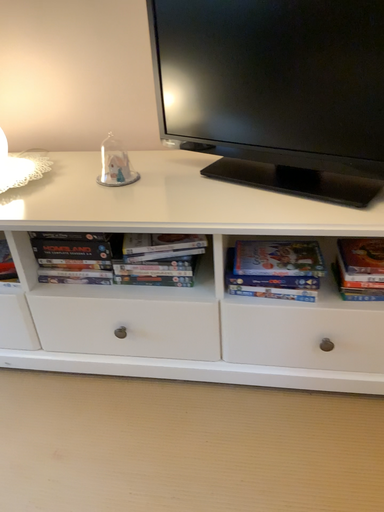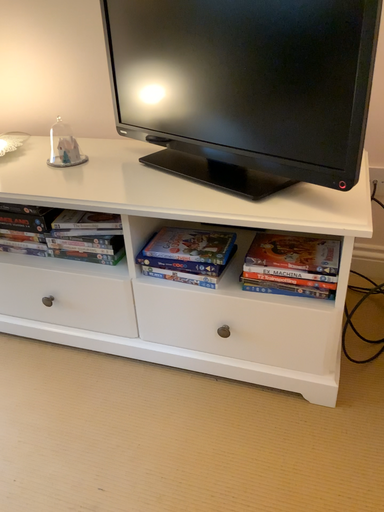
Question: Which way did the camera rotate in the video?

Choices:
 (A) rotated left
 (B) rotated right

Answer: (A)